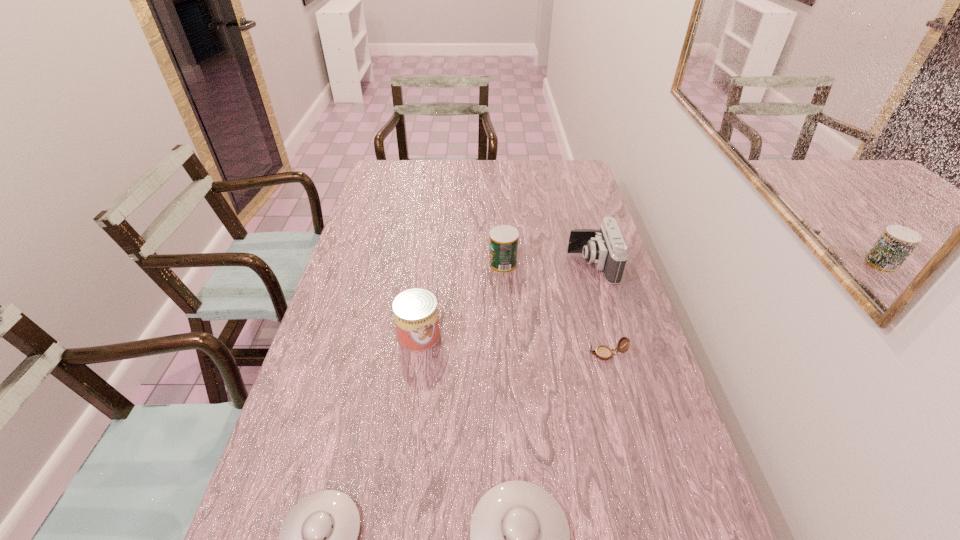
You are a GUI agent. You are given a task and a screenshot of the screen. Output one action in this format:
    pyautogui.click(x=<x>, y=<y>)
    Task: Click on the unoccupied area between the camera and the compass
    
    Given the screenshot: What is the action you would take?
    pyautogui.click(x=599, y=309)

You are a GUI agent. You are given a task and a screenshot of the screen. Output one action in this format:
    pyautogui.click(x=<x>, y=<y>)
    Task: Click on the free space between the compass and the camera
    This screenshot has height=540, width=960.
    Given the screenshot: What is the action you would take?
    pyautogui.click(x=599, y=309)

Where is `vacant space that's between the nearer can and the compass`? vacant space that's between the nearer can and the compass is located at coordinates (513, 345).

Locate an element on the screen. object that can be found as the fourth closest to the leftmost object is located at coordinates (503, 239).

Select which object appears as the fifth closest to the farther can. Please provide its 2D coordinates. Your answer should be formatted as a tuple, i.e. [(x, y)], where the tuple contains the x and y coordinates of a point satisfying the conditions above.

[(318, 539)]